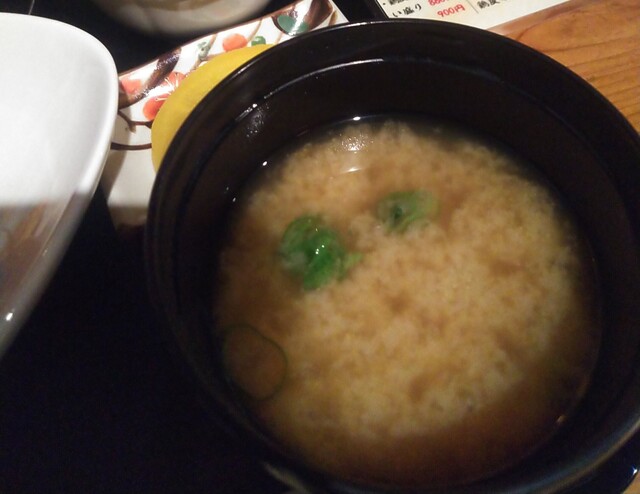
You are a GUI agent. You are given a task and a screenshot of the screen. Output one action in this format:
    pyautogui.click(x=<x>, y=<y>)
    Task: Click on the rim of white dish
    The height and width of the screenshot is (494, 640).
    Given the screenshot: What is the action you would take?
    pyautogui.click(x=50, y=20), pyautogui.click(x=109, y=121)